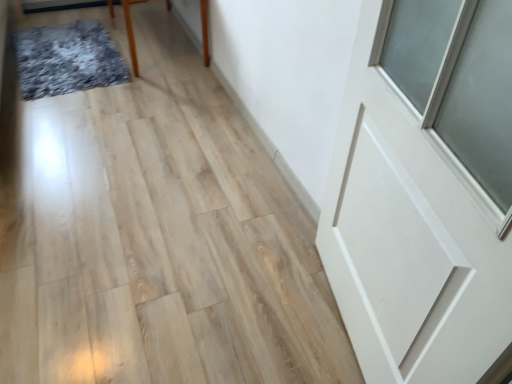
Identify the location of vacant space that is to the left of white matte door at upper right. (243, 304).